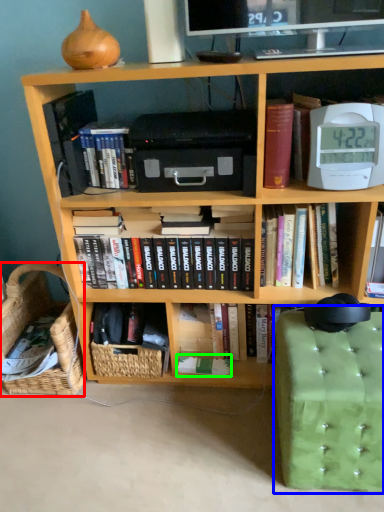
Question: Which is farther away from basket (highlighted by a red box)? swivel chair (highlighted by a blue box) or paperback book (highlighted by a green box)?

Choices:
 (A) swivel chair
 (B) paperback book

Answer: (A)